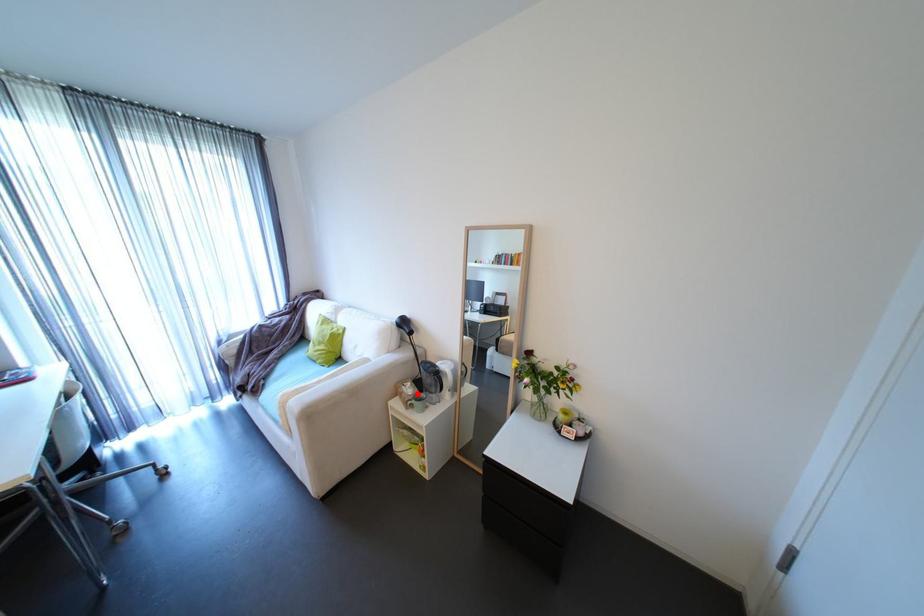
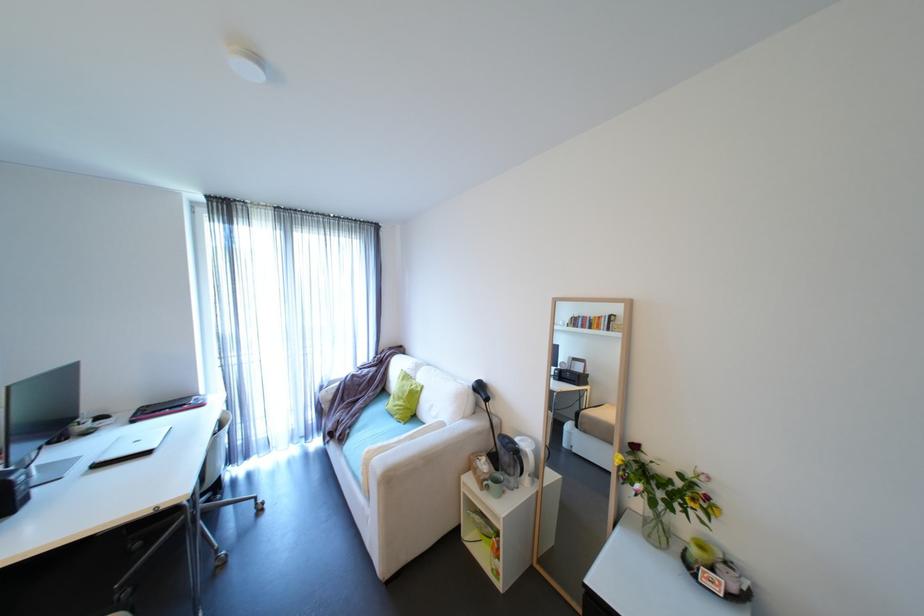
The point at the highlighted location is marked in the first image. Where is the corresponding point in the second image?

(492, 471)